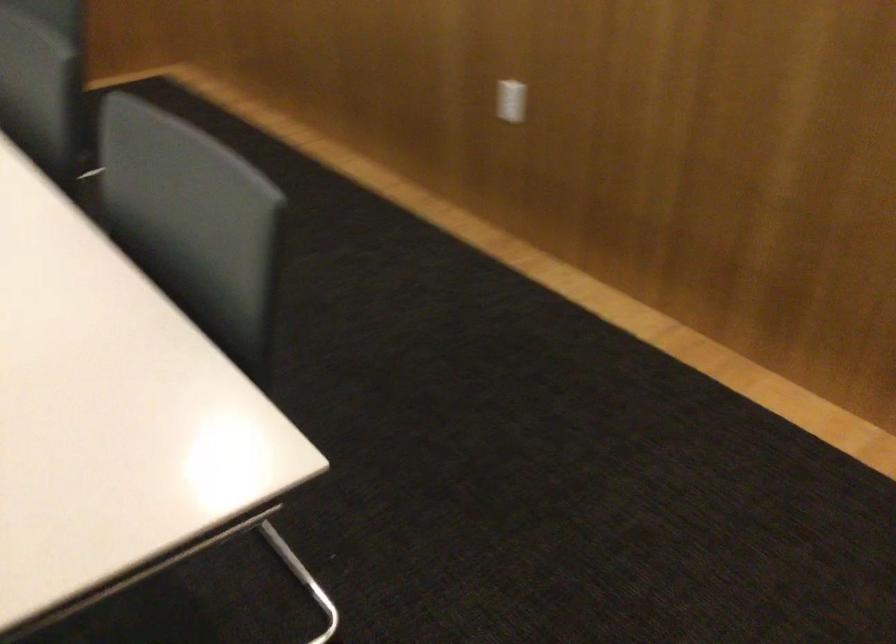
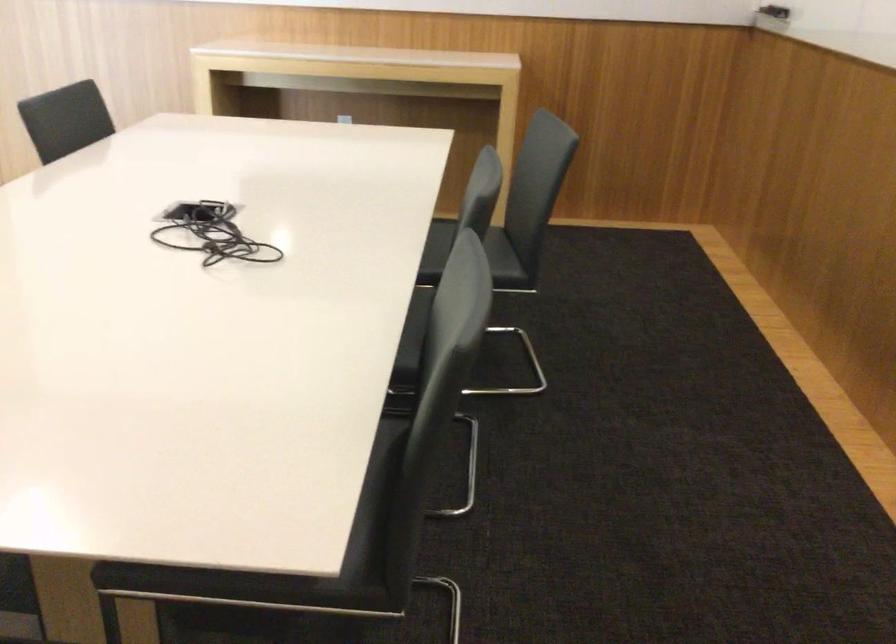
Where in the second image is the point corresponding to point 159,116 from the first image?

(470, 256)